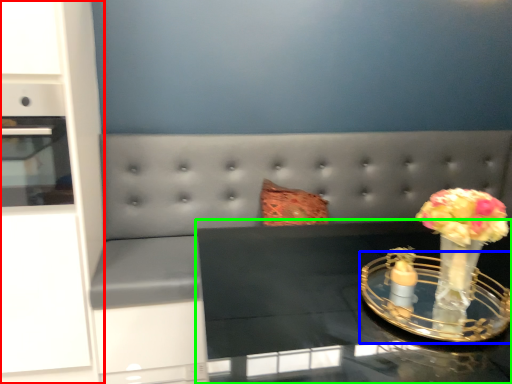
Question: Which object is the closest to the dresser (highlighted by a red box)? Choose among these: candle holder (highlighted by a blue box) or table (highlighted by a green box).

Choices:
 (A) candle holder
 (B) table

Answer: (B)